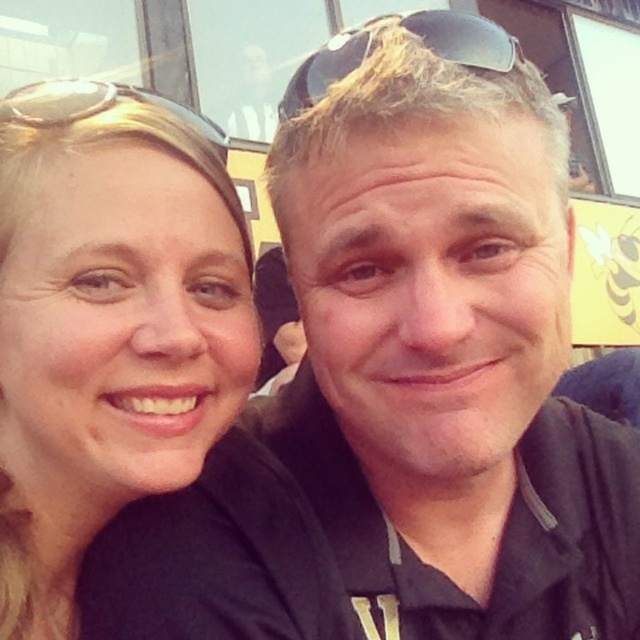
You are standing in front of the two people taking a selfie. You want to take a photo of them without getting too close. The camera you are using has a maximum focus range of 30 inches. Can you capture a clear photo of the point at point (458, 36) with your current position?

The point at point (458, 36) is 31.81 inches away from the camera, which exceeds the maximum focus range of 30 inches. Therefore, you cannot capture a clear photo of the point at point (458, 36) with your current position.

You are taking a photo of two people who are standing close together. Both have sunglasses on their heads. The sunglasses at center and the gold reflective sunglasses at upper left are visible. Which sunglasses are covering the other one?

The sunglasses at center is positioned over gold reflective sunglasses at upper left, so the sunglasses at center is covering the gold reflective sunglasses at upper left.

Based on the photo, please describe the exact location of the sunglasses at center in the image using coordinate values.

The sunglasses at center are located at coordinate point (410, 32).